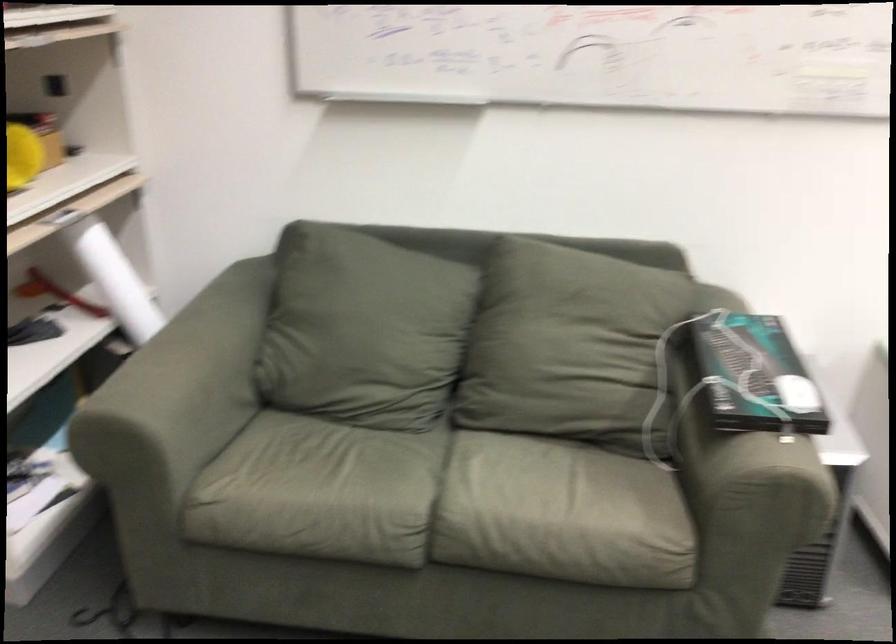
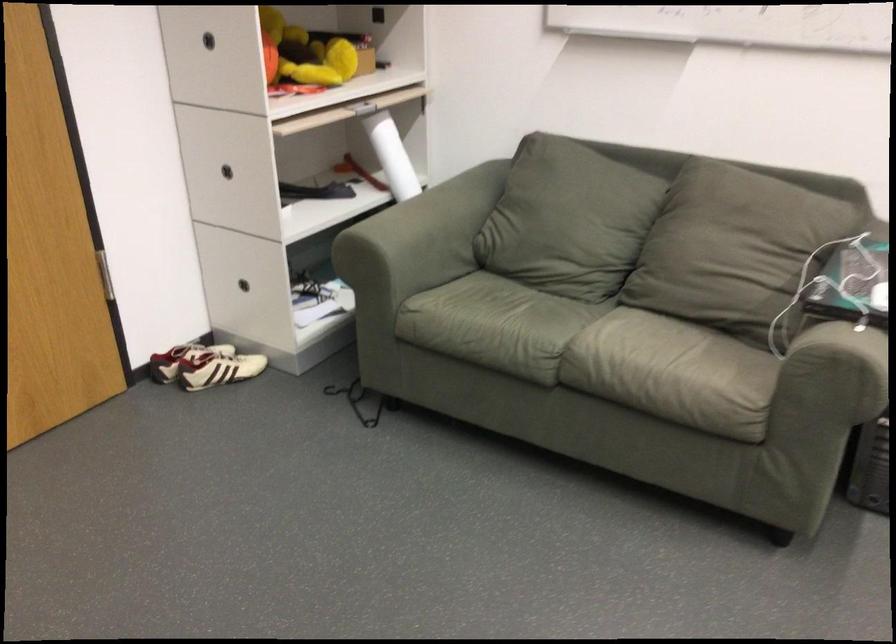
Question: How did the camera likely rotate?

Choices:
 (A) Left
 (B) Right
 (C) Up
 (D) Down

Answer: (A)